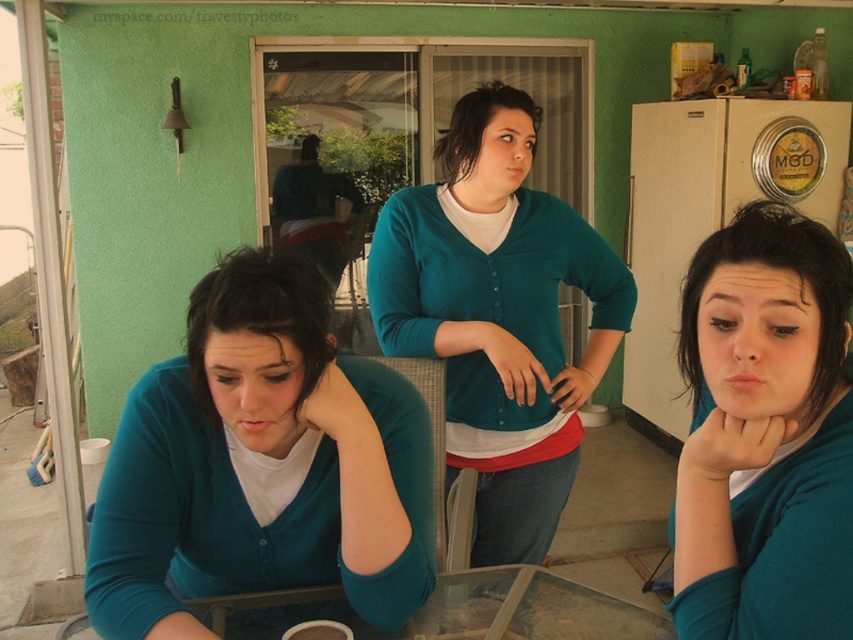
You are planning to place a small plant on the transparent glass table at center. However, there is a matte teal sweater at center on the table. Can the plant be placed there without moving the sweater?

The matte teal sweater at center is above transparent glass table at center, meaning it is currently on the table. Therefore, the plant cannot be placed there without moving the sweater.

You are trying to place a small plant on the transparent glass table at center without blocking the view of the teal matte cardigan at center. Is this possible?

The teal matte cardigan at center is above the transparent glass table at center, so placing the plant on the table would not block the view of the cardigan since the cardigan is positioned above the table.

You are planning to place a large potted plant on the transparent glass table at center. However, there is a teal matte cardigan at center in the way. Can you place the plant on the table without moving the cardigan?

The transparent glass table at center is behind the teal matte cardigan at center, so you can place the plant on the table since the cardigan is in front but not on the table itself.